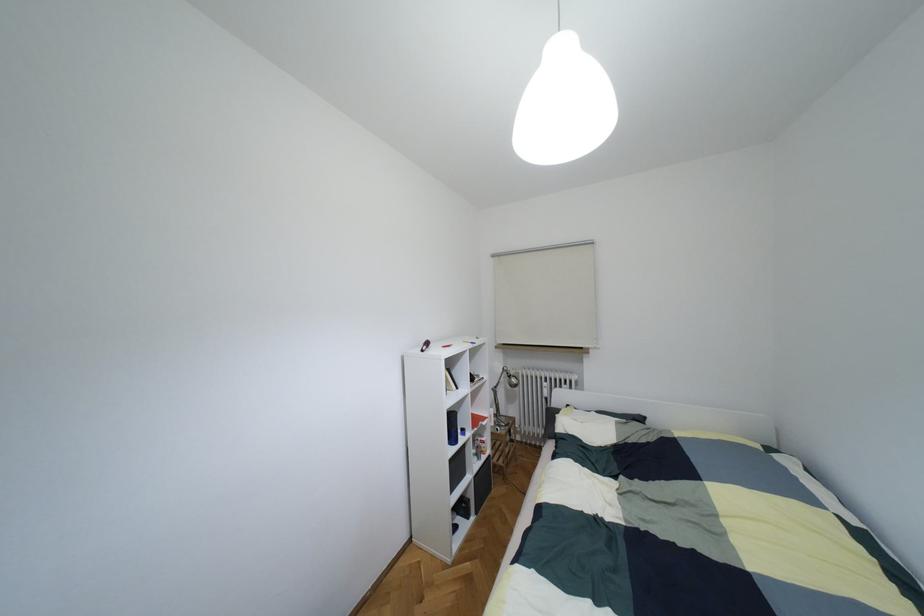
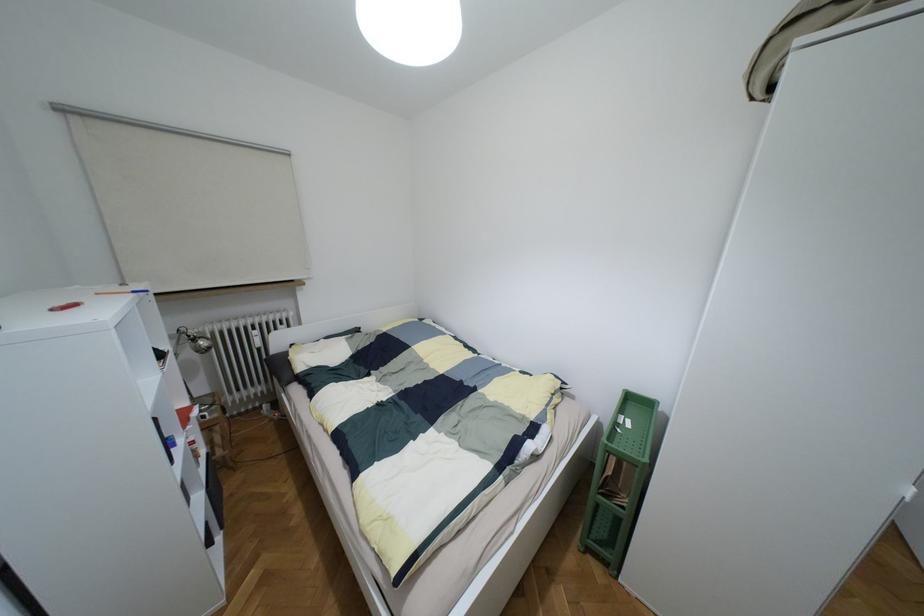
Question: Based on the continuous images, in which direction is the camera rotating? Reply with the corresponding letter.

Choices:
 (A) Left
 (B) Right
 (C) Up
 (D) Down

Answer: (B)